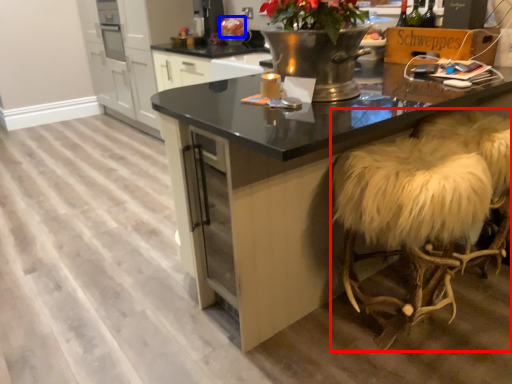
Question: Which point is closer to the camera, swivel chair (highlighted by a red box) or flower (highlighted by a blue box)?

Choices:
 (A) swivel chair
 (B) flower

Answer: (A)